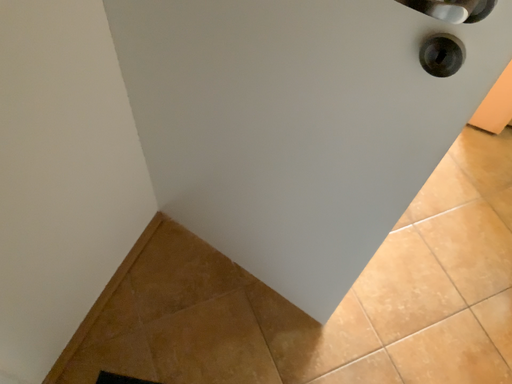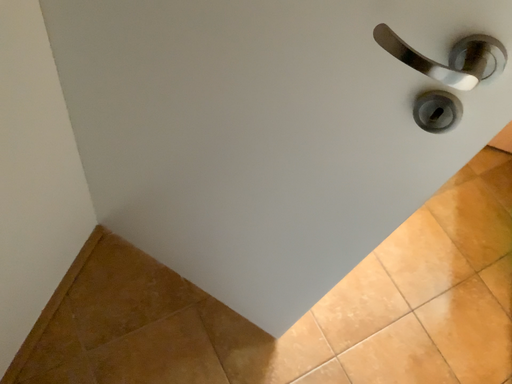
Question: How did the camera likely rotate when shooting the video?

Choices:
 (A) rotated right
 (B) rotated left

Answer: (A)